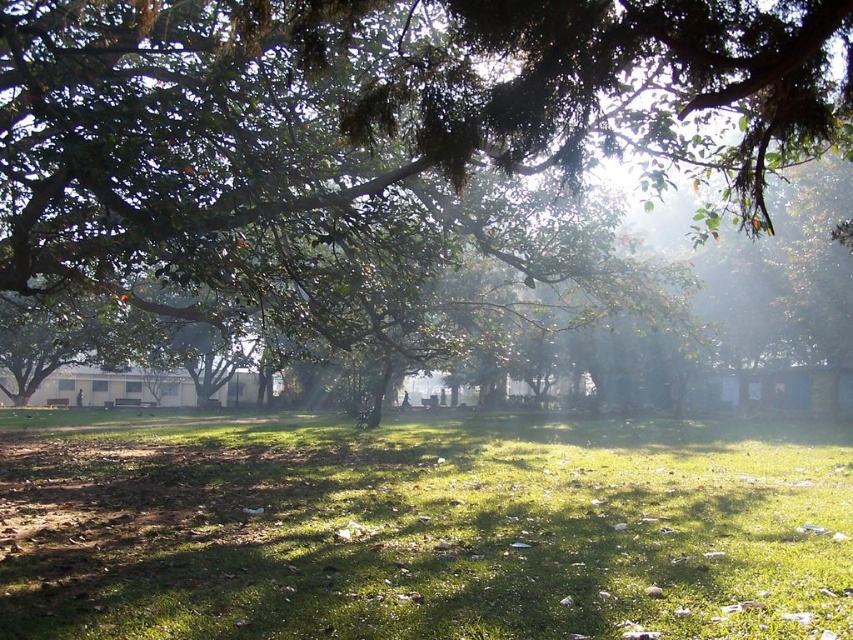
Does green grass at center lie in front of green leafy tree at center?

That is False.

Who is lower down, green grass at center or green leafy tree at center?

Positioned lower is green grass at center.

Is point (500, 419) less distant than point (531, 86)?

No, (500, 419) is behind (531, 86).

Find the location of a particular element. This screenshot has width=853, height=640. green grass at center is located at coordinates (424, 531).